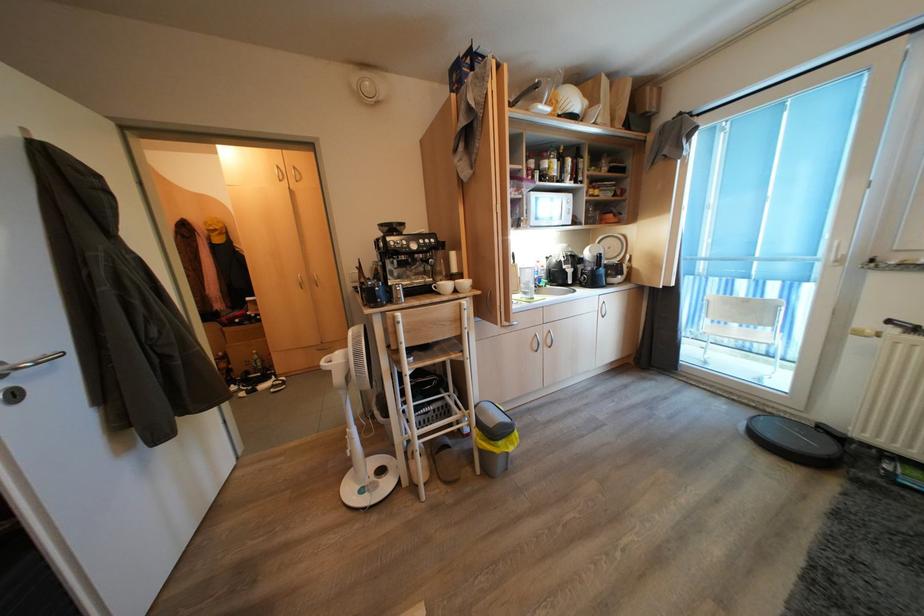
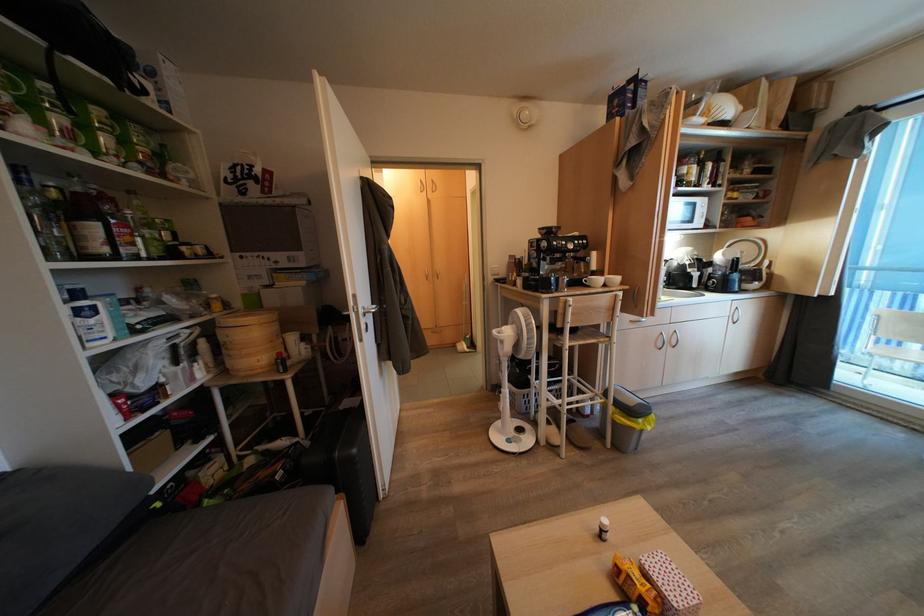
Question: The camera is either moving clockwise (left) or counter-clockwise (right) around the object. The first image is from the beginning of the video and the second image is from the end. Is the camera moving left or right when shooting the video?

Choices:
 (A) Left
 (B) Right

Answer: (B)